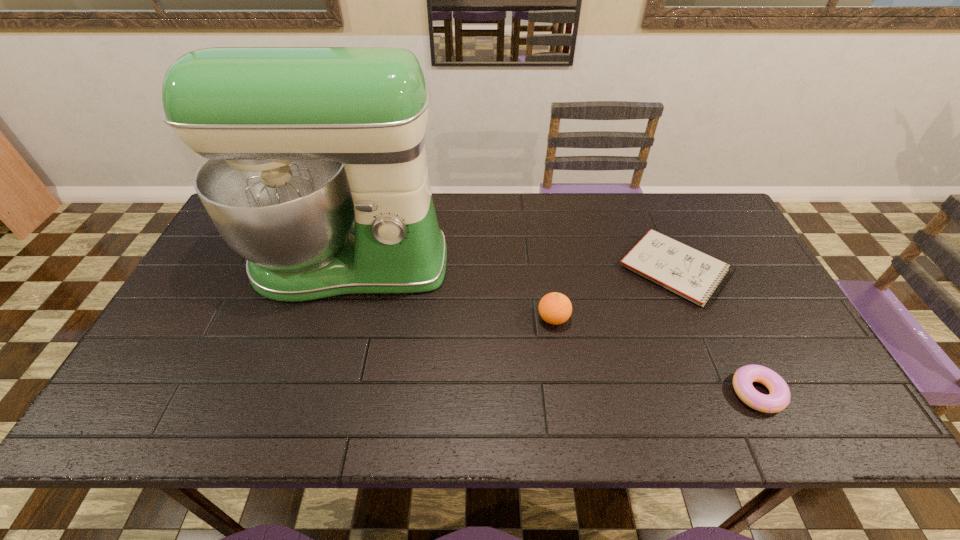
Where is `free region at the far edge of the desktop`? free region at the far edge of the desktop is located at coordinates (470, 213).

Locate an element on the screen. This screenshot has width=960, height=540. free space at the near edge is located at coordinates (283, 424).

Find the location of a particular element. The height and width of the screenshot is (540, 960). free region at the left edge is located at coordinates tap(200, 369).

In order to click on vacant region at the far right corner of the desktop in this screenshot , I will do click(685, 216).

Find the location of a particular element. This screenshot has height=540, width=960. free space that is in between the second shortest object and the notepad is located at coordinates (716, 331).

In order to click on vacant point located between the second tallest object and the doughnut in this screenshot , I will do `click(656, 355)`.

This screenshot has height=540, width=960. I want to click on vacant space in between the leftmost object and the second object from left to right, so click(451, 291).

You are a GUI agent. You are given a task and a screenshot of the screen. Output one action in this format:
    pyautogui.click(x=<x>, y=<y>)
    Task: Click on the free space between the tallest object and the nearest object
    Image resolution: width=960 pixels, height=540 pixels.
    Given the screenshot: What is the action you would take?
    pyautogui.click(x=553, y=328)

Identify the location of free spot between the third tallest object and the notepad. (716, 331).

Image resolution: width=960 pixels, height=540 pixels. Find the location of `vacant region between the doughnut and the orange`. vacant region between the doughnut and the orange is located at coordinates (656, 355).